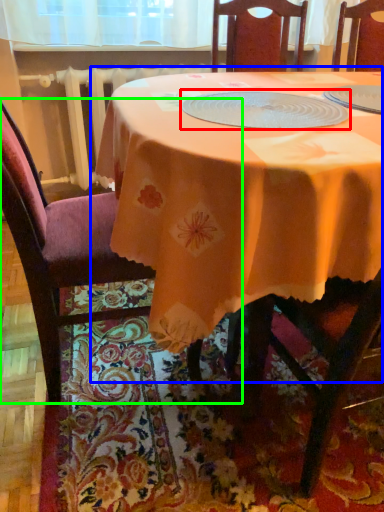
Question: Which object is the closest to the tableware (highlighted by a red box)? Choose among these: table (highlighted by a blue box) or chair (highlighted by a green box).

Choices:
 (A) table
 (B) chair

Answer: (A)